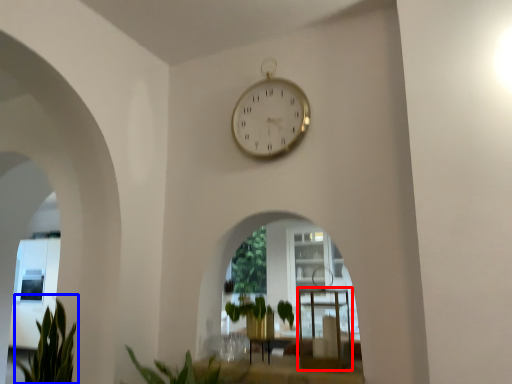
Question: Which of the following is the farthest to the observer, table (highlighted by a red box) or plant (highlighted by a blue box)?

Choices:
 (A) table
 (B) plant

Answer: (B)